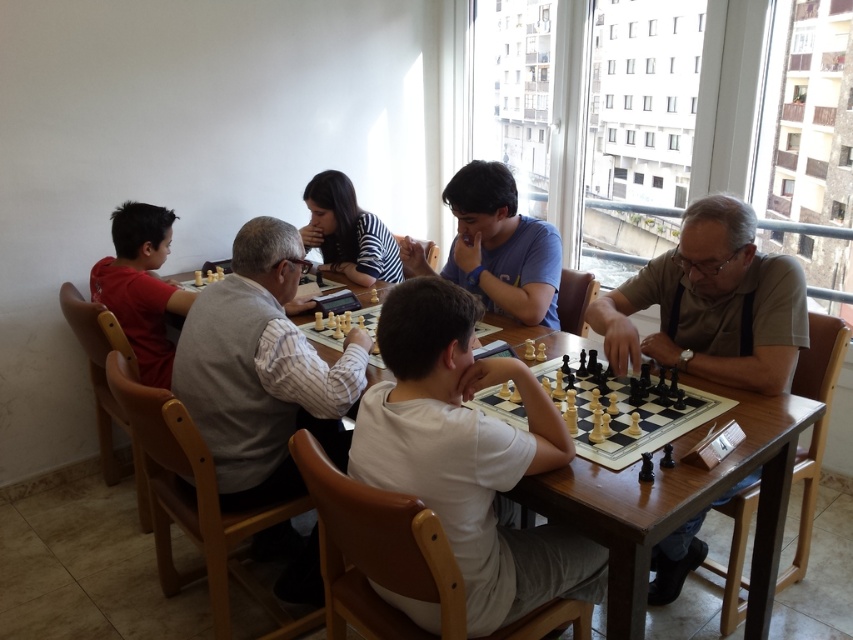
Question: Does matte beige shirt at center appear under wooden chess set at center?

Choices:
 (A) no
 (B) yes

Answer: (A)

Question: Does white cotton shirt at center appear under matte beige shirt at center?

Choices:
 (A) yes
 (B) no

Answer: (A)

Question: Estimate the real-world distances between objects in this image. Which object is farther from the matte beige shirt at center?

Choices:
 (A) matte red shirt at left
 (B) white shirt at center

Answer: (A)

Question: Which of the following is the closest to the observer?

Choices:
 (A) striped fabric shirt at center
 (B) matte blue shirt at center
 (C) wooden table at center
 (D) matte red shirt at left

Answer: (C)

Question: Which of the following is the farthest from the observer?

Choices:
 (A) (671, 314)
 (B) (466, 564)

Answer: (A)

Question: Can you confirm if matte red shirt at left is thinner than wooden chess set at center?

Choices:
 (A) yes
 (B) no

Answer: (A)